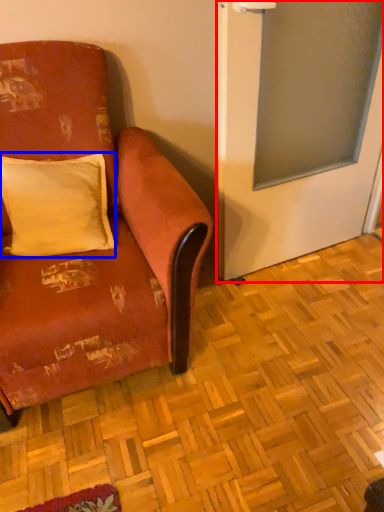
Question: Which object is further to the camera taking this photo, screen door (highlighted by a red box) or pillow (highlighted by a blue box)?

Choices:
 (A) screen door
 (B) pillow

Answer: (B)